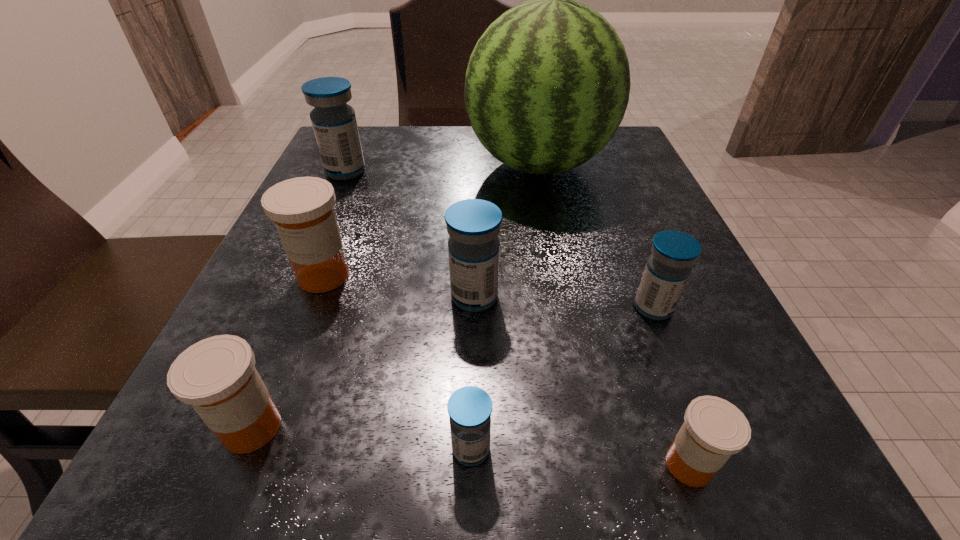
Find the location of a particular element. medicine situated at the far edge is located at coordinates (334, 123).

Identify the location of watermelon that is at the right edge. (547, 85).

At what (x,y) coordinates should I click in order to perform the action: click on object that is at the far left corner. Please return your answer as a coordinate pair (x, y). The image size is (960, 540). Looking at the image, I should click on (334, 123).

Where is `object that is positioned at the near left corner`? This screenshot has height=540, width=960. object that is positioned at the near left corner is located at coordinates (217, 376).

This screenshot has height=540, width=960. What are the coordinates of `object present at the far right corner` in the screenshot? It's located at (547, 85).

At what (x,y) coordinates should I click in order to perform the action: click on object present at the near right corner. Please return your answer as a coordinate pair (x, y). This screenshot has height=540, width=960. Looking at the image, I should click on (713, 429).

Find the location of a particular element. This screenshot has width=960, height=540. vacant area at the far edge of the desktop is located at coordinates (415, 171).

The height and width of the screenshot is (540, 960). What are the coordinates of `vacant space at the near edge of the desktop` in the screenshot? It's located at (635, 502).

In the image, there is a desktop. In order to click on free space at the left edge in this screenshot , I will do click(x=293, y=324).

This screenshot has height=540, width=960. I want to click on free region at the right edge of the desktop, so click(x=625, y=239).